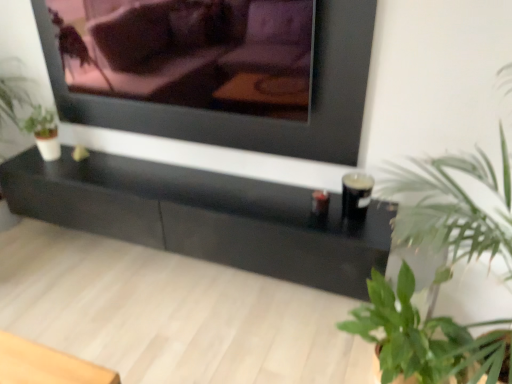
What do you see at coordinates (204, 216) in the screenshot? The image size is (512, 384). I see `black glossy table at center` at bounding box center [204, 216].

Looking at this image, measure the distance between point (408, 333) and camera.

Point (408, 333) and camera are 4.63 feet apart.

This screenshot has height=384, width=512. Identify the location of green leafy plant at right, the 1th houseplant from the top. click(454, 206).

Where is `matte black couch at upper center`? This screenshot has height=384, width=512. matte black couch at upper center is located at coordinates (191, 52).

Measure the distance between matte black couch at upper center and camera.

matte black couch at upper center is 1.65 meters from camera.

What do you see at coordinates (258, 118) in the screenshot?
I see `matte black frame at upper center` at bounding box center [258, 118].

Find the location of `black glossy table at center`. black glossy table at center is located at coordinates (204, 216).

Between matte black frame at upper center and matte black couch at upper center, which one appears on the left side from the viewer's perspective?

matte black couch at upper center.

From a real-world perspective, is matte black frame at upper center positioned over matte black couch at upper center based on gravity?

No, from a real-world perspective, matte black frame at upper center is not over matte black couch at upper center

Which of these two, matte black frame at upper center or matte black couch at upper center, stands taller?

matte black frame at upper center.

Is black glossy table at center surrounded by green leafy plant at right, acting as the 2th houseplant starting from the bottom?

That's incorrect, black glossy table at center is not inside green leafy plant at right, acting as the 2th houseplant starting from the bottom.

From a real-world perspective, who is located higher, green leafy plant at right, acting as the 2th houseplant starting from the bottom, or black glossy table at center?

green leafy plant at right, acting as the 2th houseplant starting from the bottom, from a real-world perspective.

The width and height of the screenshot is (512, 384). What are the coordinates of `table above the green leafy plant at right, the 1th houseplant from the top (from the image's perspective)` in the screenshot? It's located at (204, 216).

Is green leafy plant at right, the 1th houseplant from the top, thinner than black glossy table at center?

No.

From the image's perspective, which one is positioned lower, green leafy plant at lower right, positioned as the 1th houseplant in bottom-to-top order, or matte black couch at upper center?

green leafy plant at lower right, positioned as the 1th houseplant in bottom-to-top order, appears lower in the image.

Which of these two, green leafy plant at lower right, positioned as the 1th houseplant in bottom-to-top order, or matte black couch at upper center, is bigger?

green leafy plant at lower right, positioned as the 1th houseplant in bottom-to-top order.

Does green leafy plant at lower right, positioned as the 1th houseplant in bottom-to-top order, contain matte black couch at upper center?

Actually, matte black couch at upper center is outside green leafy plant at lower right, positioned as the 1th houseplant in bottom-to-top order.

Where is `couch on the left of the green leafy plant at lower right, which is the 2th houseplant in top-to-bottom order`? This screenshot has height=384, width=512. couch on the left of the green leafy plant at lower right, which is the 2th houseplant in top-to-bottom order is located at coordinates (191, 52).

Is green leafy plant at lower right, which is the 2th houseplant in top-to-bottom order, placed right next to green leafy plant at right, the 1th houseplant from the top?

No, green leafy plant at lower right, which is the 2th houseplant in top-to-bottom order, is not beside green leafy plant at right, the 1th houseplant from the top.

Is green leafy plant at lower right, positioned as the 1th houseplant in bottom-to-top order, aimed at green leafy plant at right, acting as the 2th houseplant starting from the bottom?

Yes, green leafy plant at lower right, positioned as the 1th houseplant in bottom-to-top order, is aimed at green leafy plant at right, acting as the 2th houseplant starting from the bottom.

Based on the photo, choose the correct answer: Is green leafy plant at lower right, positioned as the 1th houseplant in bottom-to-top order, inside green leafy plant at right, acting as the 2th houseplant starting from the bottom, or outside it?

green leafy plant at lower right, positioned as the 1th houseplant in bottom-to-top order, is located inside green leafy plant at right, acting as the 2th houseplant starting from the bottom.

The height and width of the screenshot is (384, 512). Identify the location of table located behind the matte black couch at upper center. (204, 216).

Which object is thinner, black glossy table at center or matte black couch at upper center?

matte black couch at upper center is thinner.

Consider the image. Which is behind, black glossy table at center or matte black couch at upper center?

black glossy table at center is further away from the camera.

From the image's perspective, which is above, black glossy table at center or matte black couch at upper center?

From the image's view, matte black couch at upper center is above.

Considering the sizes of matte black frame at upper center and green leafy plant at lower right, positioned as the 1th houseplant in bottom-to-top order, in the image, is matte black frame at upper center bigger or smaller than green leafy plant at lower right, positioned as the 1th houseplant in bottom-to-top order,?

matte black frame at upper center is smaller than green leafy plant at lower right, positioned as the 1th houseplant in bottom-to-top order.

How different are the orientations of matte black frame at upper center and green leafy plant at lower right, positioned as the 1th houseplant in bottom-to-top order, in degrees?

3.35 degrees separate the facing orientations of matte black frame at upper center and green leafy plant at lower right, positioned as the 1th houseplant in bottom-to-top order.

From the image's perspective, is matte black frame at upper center located above or below green leafy plant at lower right, positioned as the 1th houseplant in bottom-to-top order?

matte black frame at upper center is above green leafy plant at lower right, positioned as the 1th houseplant in bottom-to-top order.

Does matte black frame at upper center turn towards green leafy plant at lower right, positioned as the 1th houseplant in bottom-to-top order?

No, matte black frame at upper center is not oriented towards green leafy plant at lower right, positioned as the 1th houseplant in bottom-to-top order.

Considering the sizes of objects black glossy table at center and matte black frame at upper center in the image provided, who is taller, black glossy table at center or matte black frame at upper center?

matte black frame at upper center is taller.

Could you tell me if black glossy table at center is turned towards matte black frame at upper center?

No, black glossy table at center does not turn towards matte black frame at upper center.

Does point (124, 221) appear closer or farther from the camera than point (278, 126)?

Point (124, 221) appears to be farther away from the viewer than point (278, 126).

The height and width of the screenshot is (384, 512). What are the coordinates of `picture frame in front of the black glossy table at center` in the screenshot? It's located at (258, 118).

You are a GUI agent. You are given a task and a screenshot of the screen. Output one action in this format:
    pyautogui.click(x=<x>, y=<y>)
    Task: Click on the couch that is above the matte black frame at upper center (from the image's perspective)
    This screenshot has height=384, width=512.
    Given the screenshot: What is the action you would take?
    pyautogui.click(x=191, y=52)

You are a GUI agent. You are given a task and a screenshot of the screen. Output one action in this format:
    pyautogui.click(x=<x>, y=<y>)
    Task: Click on the table that appears behind the green leafy plant at right, the 1th houseplant from the top
    This screenshot has width=512, height=384.
    Given the screenshot: What is the action you would take?
    pyautogui.click(x=204, y=216)

Considering their positions, is green leafy plant at lower right, positioned as the 1th houseplant in bottom-to-top order, positioned further to black glossy table at center than matte black frame at upper center?

green leafy plant at lower right, positioned as the 1th houseplant in bottom-to-top order, is further to black glossy table at center.

Looking at this image, which object lies nearer to the anchor point black glossy table at center, matte black frame at upper center or green leafy plant at lower right, positioned as the 1th houseplant in bottom-to-top order?

The object closer to black glossy table at center is matte black frame at upper center.

Based on their spatial positions, is green leafy plant at lower right, positioned as the 1th houseplant in bottom-to-top order, or matte black couch at upper center closer to green leafy plant at right, acting as the 2th houseplant starting from the bottom?

Among the two, green leafy plant at lower right, positioned as the 1th houseplant in bottom-to-top order, is located nearer to green leafy plant at right, acting as the 2th houseplant starting from the bottom.

Based on their spatial positions, is matte black frame at upper center or matte black couch at upper center closer to black glossy table at center?

Based on the image, matte black frame at upper center appears to be nearer to black glossy table at center.

Based on their spatial positions, is black glossy table at center or green leafy plant at lower right, positioned as the 1th houseplant in bottom-to-top order, further from green leafy plant at right, the 1th houseplant from the top?

Among the two, black glossy table at center is located further to green leafy plant at right, the 1th houseplant from the top.

Considering their positions, is matte black couch at upper center positioned closer to black glossy table at center than green leafy plant at lower right, which is the 2th houseplant in top-to-bottom order?

green leafy plant at lower right, which is the 2th houseplant in top-to-bottom order.

Looking at the image, which one is located further to matte black couch at upper center, green leafy plant at lower right, which is the 2th houseplant in top-to-bottom order, or green leafy plant at right, acting as the 2th houseplant starting from the bottom?

Among the two, green leafy plant at lower right, which is the 2th houseplant in top-to-bottom order, is located further to matte black couch at upper center.

Which object lies further to the anchor point matte black couch at upper center, black glossy table at center or green leafy plant at right, the 1th houseplant from the top?

The object further to matte black couch at upper center is green leafy plant at right, the 1th houseplant from the top.

Where is `houseplant between matte black frame at upper center and green leafy plant at lower right, which is the 2th houseplant in top-to-bottom order, in the vertical direction`? The height and width of the screenshot is (384, 512). houseplant between matte black frame at upper center and green leafy plant at lower right, which is the 2th houseplant in top-to-bottom order, in the vertical direction is located at coordinates (454, 206).

You are a GUI agent. You are given a task and a screenshot of the screen. Output one action in this format:
    pyautogui.click(x=<x>, y=<y>)
    Task: Click on the picture frame located between green leafy plant at right, acting as the 2th houseplant starting from the bottom, and black glossy table at center in the depth direction
    
    Given the screenshot: What is the action you would take?
    pyautogui.click(x=258, y=118)

Image resolution: width=512 pixels, height=384 pixels. What are the coordinates of `picture frame between matte black couch at upper center and black glossy table at center in the up-down direction` in the screenshot? It's located at (258, 118).

This screenshot has height=384, width=512. What are the coordinates of `houseplant between green leafy plant at right, the 1th houseplant from the top, and black glossy table at center from front to back` in the screenshot? It's located at (422, 337).